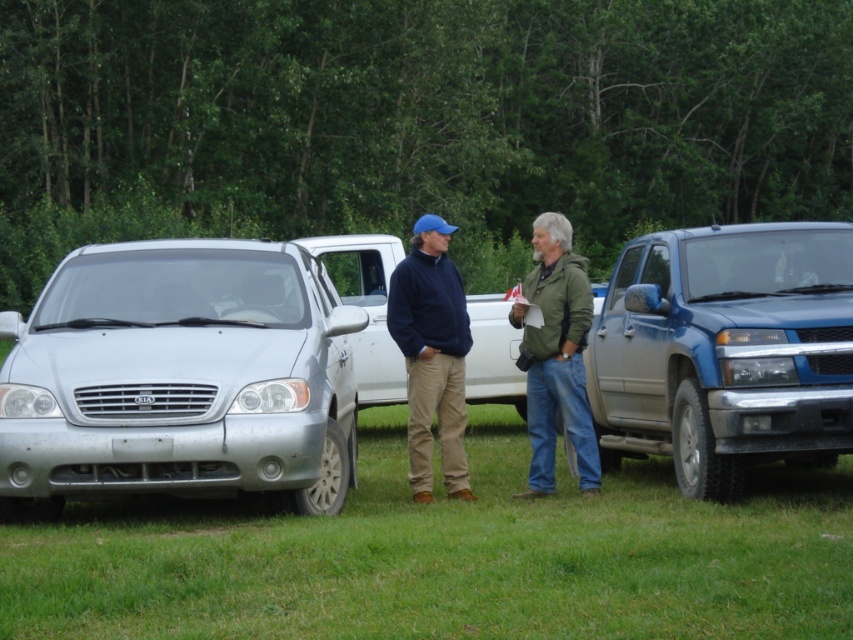
Does blue metallic truck at right have a lesser height compared to green textured jacket at center?

In fact, blue metallic truck at right may be taller than green textured jacket at center.

Does blue metallic truck at right appear under green textured jacket at center?

No, blue metallic truck at right is not below green textured jacket at center.

Between point (704, 486) and point (560, 328), which one is positioned in front?

Point (704, 486) is in front.

Identify the location of blue metallic truck at right. (724, 349).

Does silver metallic van at center have a greater width compared to blue metallic truck at right?

Yes, silver metallic van at center is wider than blue metallic truck at right.

Who is more forward, (286, 499) or (631, 348)?

Point (286, 499) is in front.

Who is more distant from viewer, (x=70, y=392) or (x=740, y=294)?

Point (x=740, y=294)

Where is `silver metallic van at center`? This screenshot has width=853, height=640. silver metallic van at center is located at coordinates (178, 378).

Is green textured jacket at center smaller than navy blue fleece at center?

No.

Is green textured jacket at center thinner than navy blue fleece at center?

No.

Is point (427, 412) less distant than point (419, 337)?

No, (427, 412) is further to viewer.

Identify the location of green textured jacket at center. (432, 355).